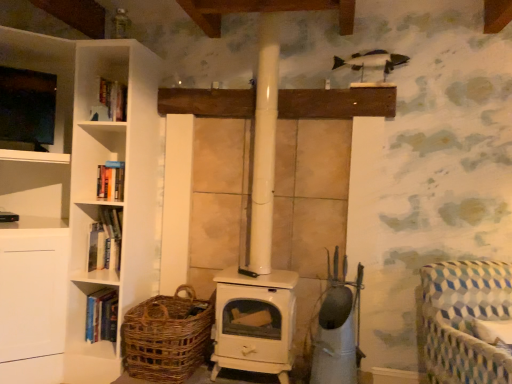
Question: Is woven brown basket at lower left facing towards hardcover book at left, which appears as the first book when ordered from the bottom?

Choices:
 (A) yes
 (B) no

Answer: (B)

Question: Can you confirm if woven brown basket at lower left is wider than hardcover book at left, which appears as the first book when ordered from the bottom?

Choices:
 (A) no
 (B) yes

Answer: (B)

Question: Can you confirm if woven brown basket at lower left is taller than hardcover book at left, which appears as the first book when ordered from the bottom?

Choices:
 (A) yes
 (B) no

Answer: (A)

Question: Is woven brown basket at lower left located outside hardcover book at left, which appears as the first book when ordered from the bottom?

Choices:
 (A) no
 (B) yes

Answer: (B)

Question: From the image's perspective, does woven brown basket at lower left appear lower than hardcover book at left, which appears as the first book when ordered from the bottom?

Choices:
 (A) no
 (B) yes

Answer: (A)

Question: Is woven brown basket at lower left situated inside hardcover book at left, the 2th book when ordered from bottom to top, or outside?

Choices:
 (A) outside
 (B) inside

Answer: (A)

Question: Is woven brown basket at lower left to the left or to the right of hardcover book at left, the 2th book when ordered from bottom to top, in the image?

Choices:
 (A) right
 (B) left

Answer: (A)

Question: From their relative heights in the image, would you say woven brown basket at lower left is taller or shorter than hardcover book at left, the 2th book when ordered from bottom to top?

Choices:
 (A) short
 (B) tall

Answer: (B)

Question: In the image, is woven brown basket at lower left positioned in front of or behind hardcover book at left, which appears as the first book when viewed from the top?

Choices:
 (A) behind
 (B) front

Answer: (B)

Question: Based on their sizes in the image, would you say blue and white checkered fabric rocking chair at lower right is bigger or smaller than hardcover book at left, which is counted as the 2th book, starting from the top?

Choices:
 (A) small
 (B) big

Answer: (B)

Question: From a real-world perspective, is blue and white checkered fabric rocking chair at lower right above or below hardcover book at left, which appears as the first book when ordered from the bottom?

Choices:
 (A) below
 (B) above

Answer: (B)

Question: Would you say blue and white checkered fabric rocking chair at lower right is inside or outside hardcover book at left, which is counted as the 2th book, starting from the top?

Choices:
 (A) outside
 (B) inside

Answer: (A)

Question: Would you say blue and white checkered fabric rocking chair at lower right is to the left or to the right of hardcover book at left, which appears as the first book when ordered from the bottom, in the picture?

Choices:
 (A) right
 (B) left

Answer: (A)

Question: Looking at their shapes, would you say hardcover book at left, the 2th book when ordered from bottom to top, is wider or thinner than blue and white checkered fabric rocking chair at lower right?

Choices:
 (A) thin
 (B) wide

Answer: (A)

Question: Do you think hardcover book at left, which appears as the first book when viewed from the top, is within blue and white checkered fabric rocking chair at lower right, or outside of it?

Choices:
 (A) outside
 (B) inside

Answer: (A)